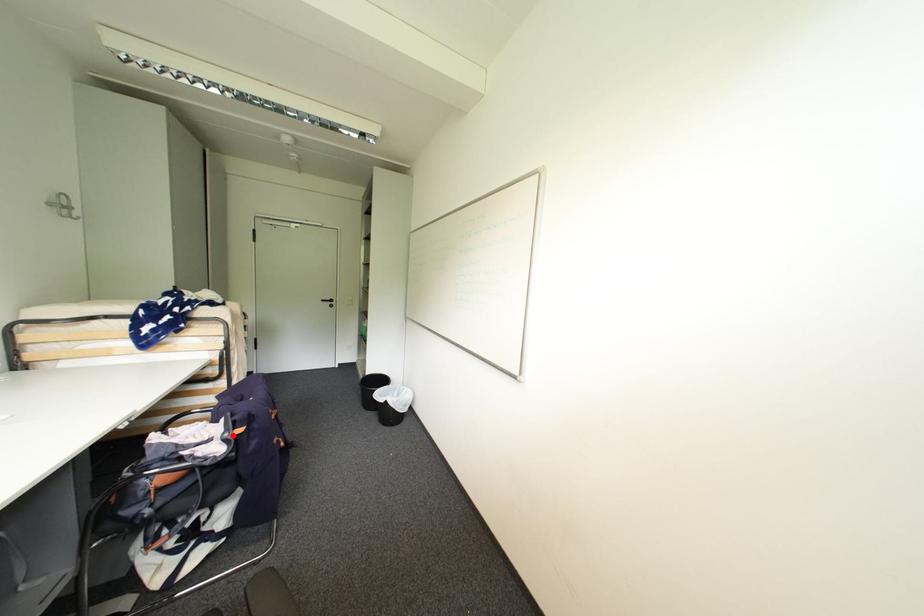
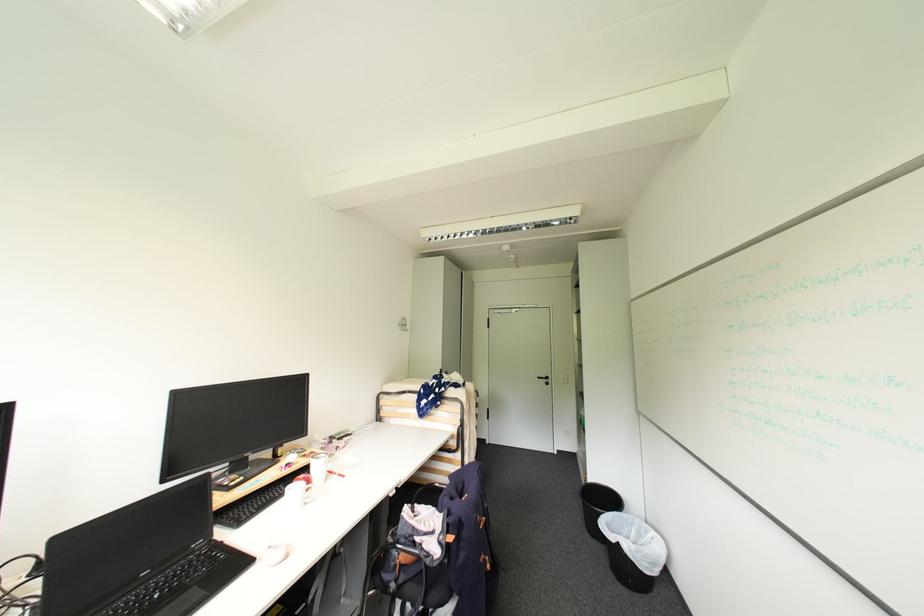
The point at the highlighted location is marked in the first image. Where is the corresponding point in the second image?

(447, 538)